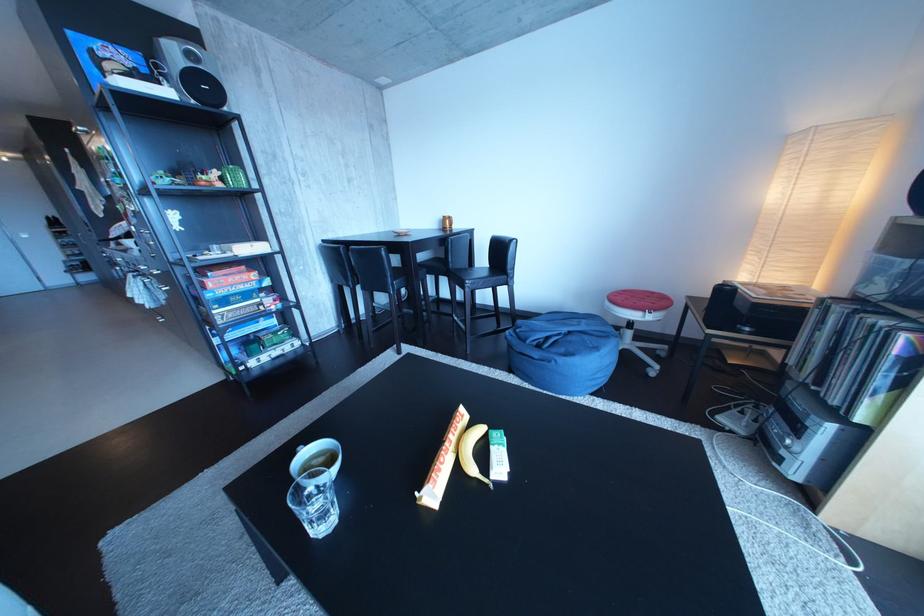
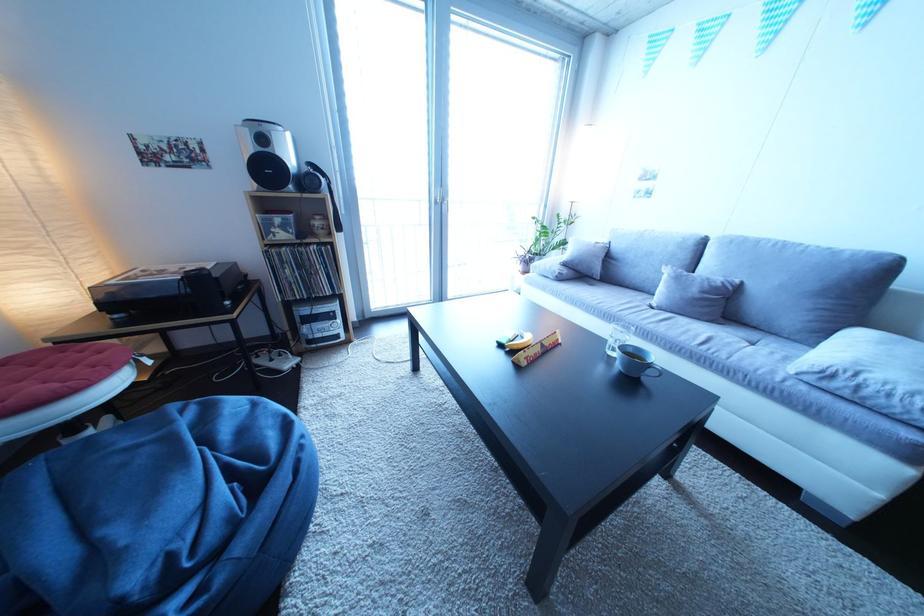
The point at (755, 419) is marked in the first image. Where is the corresponding point in the second image?

(285, 366)